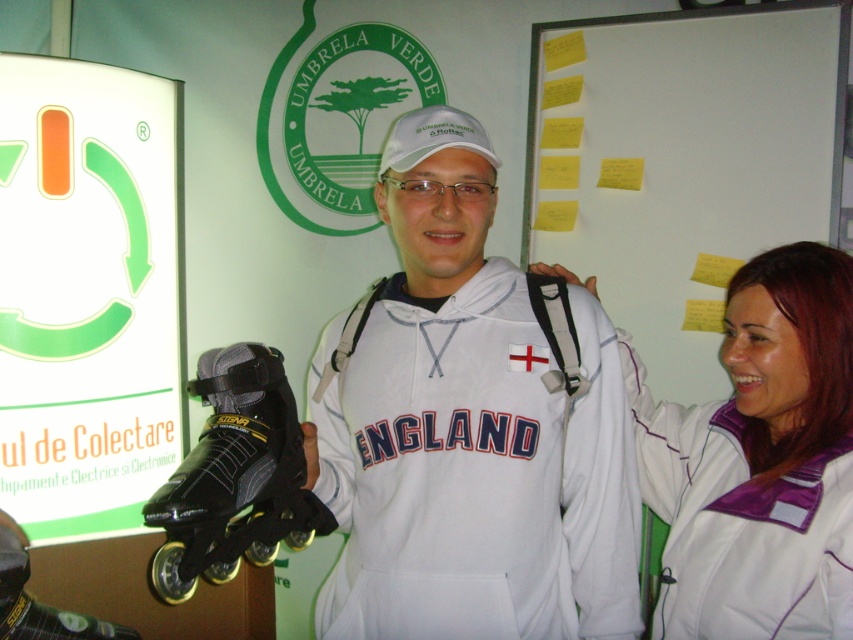
Who is higher up, white matte sweatshirt at center or yellow paper at upper center?

yellow paper at upper center is above.

How far apart are white matte sweatshirt at center and yellow paper at upper center?

They are 95.47 centimeters apart.

Identify the location of white matte sweatshirt at center. (469, 429).

Is green matte sign at upper left positioned behind white fleece jacket at center?

Yes, green matte sign at upper left is further from the viewer.

Does green matte sign at upper left have a lesser width compared to white fleece jacket at center?

Yes.

This screenshot has height=640, width=853. What do you see at coordinates (86, 292) in the screenshot? I see `green matte sign at upper left` at bounding box center [86, 292].

This screenshot has height=640, width=853. I want to click on green matte sign at upper left, so click(86, 292).

Who is positioned more to the left, white matte sweatshirt at center or black rubber roller skate at center?

From the viewer's perspective, black rubber roller skate at center appears more on the left side.

Is white matte sweatshirt at center wider than black rubber roller skate at center?

Yes.

Between point (537, 380) and point (166, 488), which one is positioned behind?

The point (537, 380) is behind.

You are a GUI agent. You are given a task and a screenshot of the screen. Output one action in this format:
    pyautogui.click(x=<x>, y=<y>)
    Task: Click on the white matte sweatshirt at center
    Image resolution: width=853 pixels, height=640 pixels.
    Given the screenshot: What is the action you would take?
    pyautogui.click(x=469, y=429)